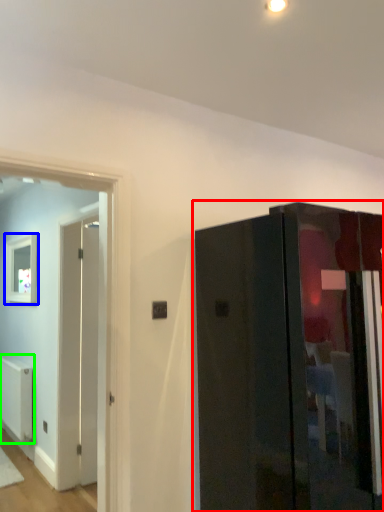
Question: Which object is positioned farthest from door (highlighted by a red box)? Select from picture frame (highlighted by a blue box) and radiator (highlighted by a green box).

Choices:
 (A) picture frame
 (B) radiator

Answer: (B)